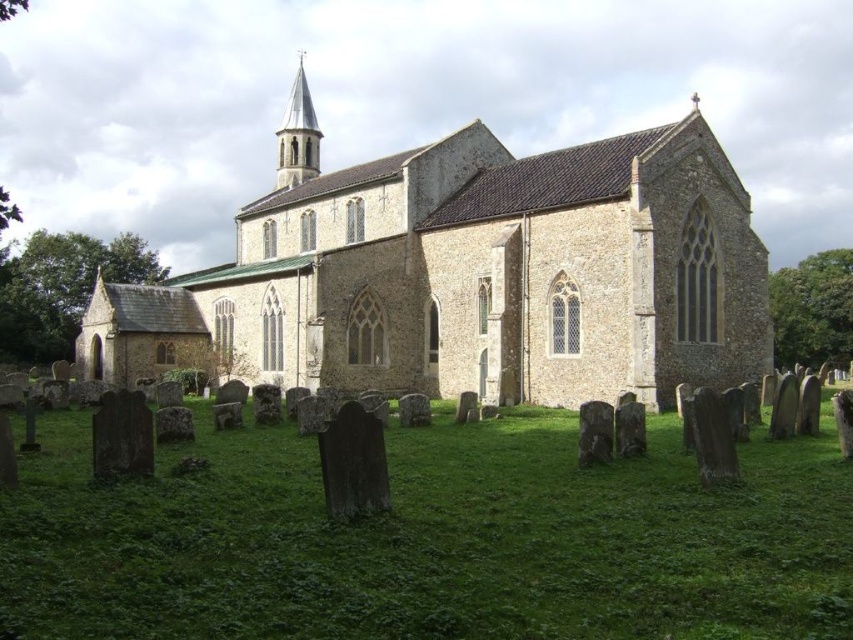
Question: Which object appears farthest from the camera in this image?

Choices:
 (A) white stone spire at upper center
 (B) stone church at center

Answer: (A)

Question: Is the position of stone church at center more distant than that of white stone spire at upper center?

Choices:
 (A) yes
 (B) no

Answer: (B)

Question: Which is nearer to the white stone spire at upper center?

Choices:
 (A) stone church at center
 (B) green grass at lower center

Answer: (A)

Question: Does green grass at lower center lie behind stone church at center?

Choices:
 (A) yes
 (B) no

Answer: (B)

Question: Which point is farther to the camera?

Choices:
 (A) (300, 180)
 (B) (450, 323)

Answer: (A)

Question: Observing the image, what is the correct spatial positioning of green grass at lower center in reference to stone church at center?

Choices:
 (A) below
 (B) above

Answer: (A)